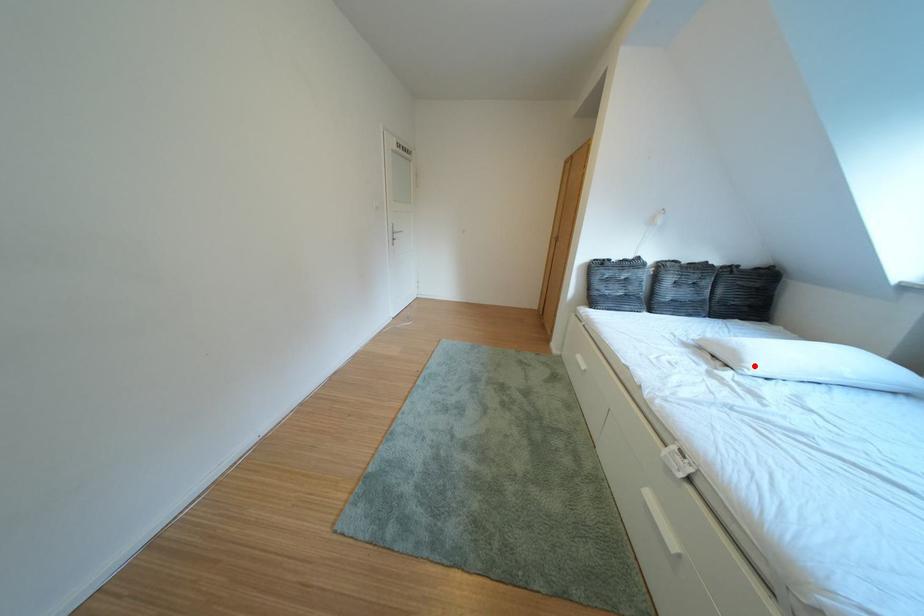
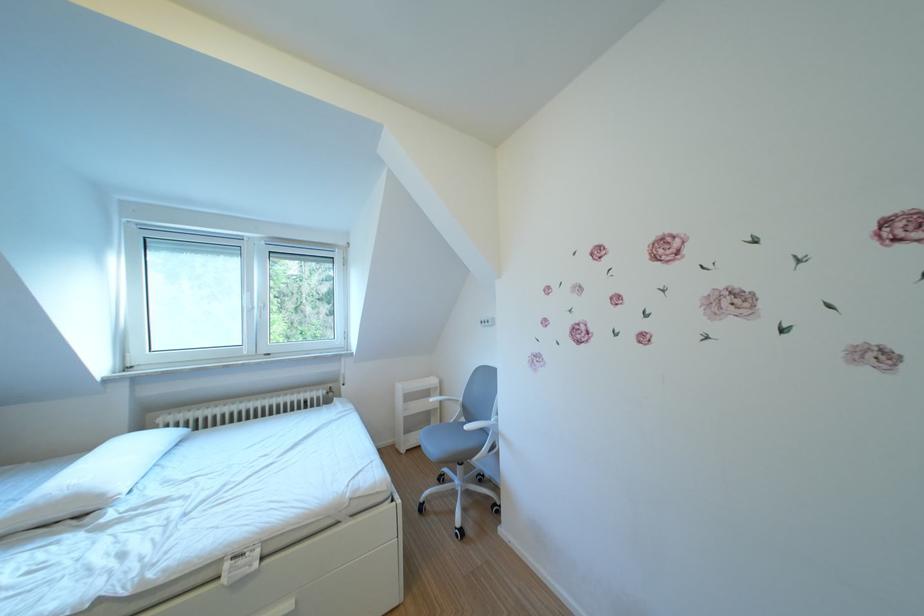
Question: I am providing you with two images of the same scene from different viewpoints. Given a red point in image1, look at the same physical point in image2. Is it:

Choices:
 (A) Closer to the viewpoint
 (B) Farther from the viewpoint

Answer: (A)